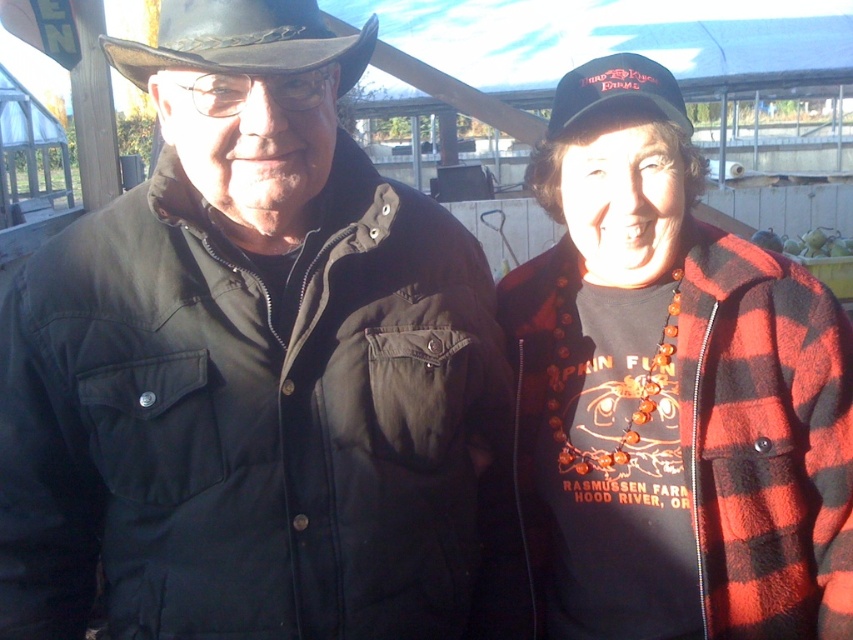
Which is more to the right, brown leather cowboy hat at upper left or black fabric baseball cap at upper right?

black fabric baseball cap at upper right is more to the right.

Between point (103, 54) and point (579, 104), which one is positioned in front?

Point (579, 104) is more forward.

Who is more forward, (165, 0) or (610, 74)?

Point (165, 0)

The width and height of the screenshot is (853, 640). I want to click on brown leather cowboy hat at upper left, so click(x=242, y=40).

Between point (653, 445) and point (576, 88), which one is positioned behind?

The point (576, 88) is behind.

In the scene shown: Is red plaid jacket at right to the left of black fabric baseball cap at upper right from the viewer's perspective?

Incorrect, red plaid jacket at right is not on the left side of black fabric baseball cap at upper right.

This screenshot has width=853, height=640. Identify the location of red plaid jacket at right. (671, 394).

Is matte black jacket at left below red plaid jacket at right?

Correct, matte black jacket at left is located below red plaid jacket at right.

Is matte black jacket at left further to the viewer compared to red plaid jacket at right?

No.

Locate an element on the screen. This screenshot has height=640, width=853. matte black jacket at left is located at coordinates (251, 369).

You are a GUI agent. You are given a task and a screenshot of the screen. Output one action in this format:
    pyautogui.click(x=<x>, y=<y>)
    Task: Click on the matte black jacket at left
    The width and height of the screenshot is (853, 640).
    Given the screenshot: What is the action you would take?
    pyautogui.click(x=251, y=369)